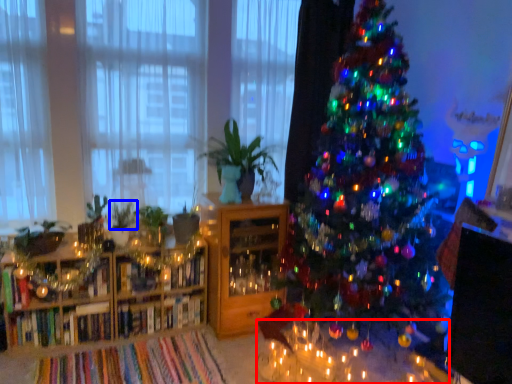
Question: Which point is closer to the camera, table (highlighted by a red box) or plant (highlighted by a blue box)?

Choices:
 (A) table
 (B) plant

Answer: (A)